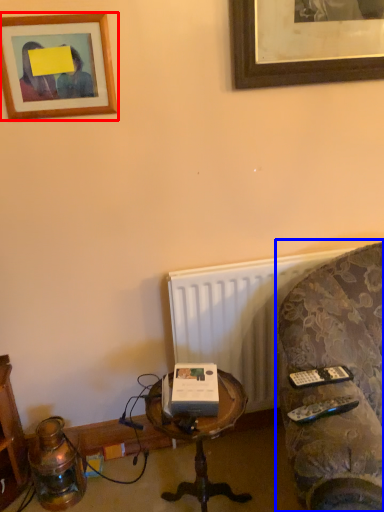
Question: Among these objects, which one is farthest to the camera, picture frame (highlighted by a red box) or studio couch (highlighted by a blue box)?

Choices:
 (A) picture frame
 (B) studio couch

Answer: (A)